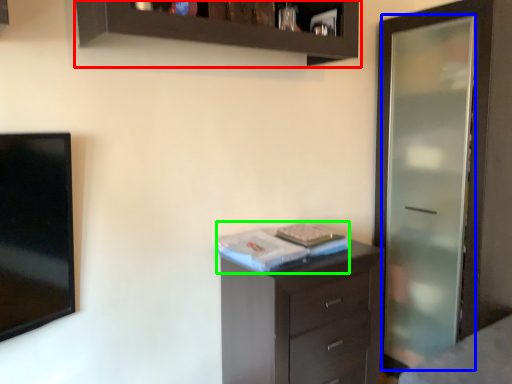
Question: Based on their relative distances, which object is nearer to cupboard (highlighted by a red box)? Choose from screen door (highlighted by a blue box) and book (highlighted by a green box).

Choices:
 (A) screen door
 (B) book

Answer: (B)